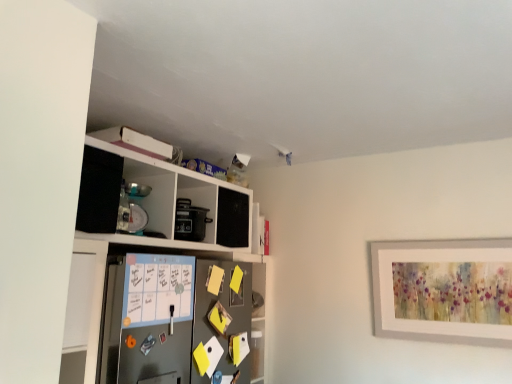
Question: From the image's perspective, would you say metallic gray refrigerator at center is shown under white matte cabinet at upper left?

Choices:
 (A) yes
 (B) no

Answer: (A)

Question: Considering the relative positions of metallic gray refrigerator at center and white matte cabinet at upper left in the image provided, is metallic gray refrigerator at center behind white matte cabinet at upper left?

Choices:
 (A) no
 (B) yes

Answer: (B)

Question: Are metallic gray refrigerator at center and white matte cabinet at upper left making contact?

Choices:
 (A) yes
 (B) no

Answer: (B)

Question: Could you tell me if metallic gray refrigerator at center is turned towards white matte cabinet at upper left?

Choices:
 (A) no
 (B) yes

Answer: (B)

Question: Does metallic gray refrigerator at center have a lesser height compared to white matte cabinet at upper left?

Choices:
 (A) yes
 (B) no

Answer: (A)

Question: Is metallic gray refrigerator at center turned away from white matte cabinet at upper left?

Choices:
 (A) no
 (B) yes

Answer: (B)

Question: Is white matte cabinet at upper left at the left side of metallic gray refrigerator at center?

Choices:
 (A) yes
 (B) no

Answer: (A)

Question: Is white matte cabinet at upper left beside metallic gray refrigerator at center?

Choices:
 (A) yes
 (B) no

Answer: (B)

Question: Does white matte cabinet at upper left have a lesser width compared to metallic gray refrigerator at center?

Choices:
 (A) no
 (B) yes

Answer: (A)

Question: From the image's perspective, is white matte cabinet at upper left under metallic gray refrigerator at center?

Choices:
 (A) yes
 (B) no

Answer: (B)

Question: Can we say white matte cabinet at upper left lies outside metallic gray refrigerator at center?

Choices:
 (A) yes
 (B) no

Answer: (A)

Question: Would you say white matte cabinet at upper left is a long distance from metallic gray refrigerator at center?

Choices:
 (A) no
 (B) yes

Answer: (A)

Question: Is white matte cabinet at upper left situated inside metallic gray refrigerator at center or outside?

Choices:
 (A) outside
 (B) inside

Answer: (A)